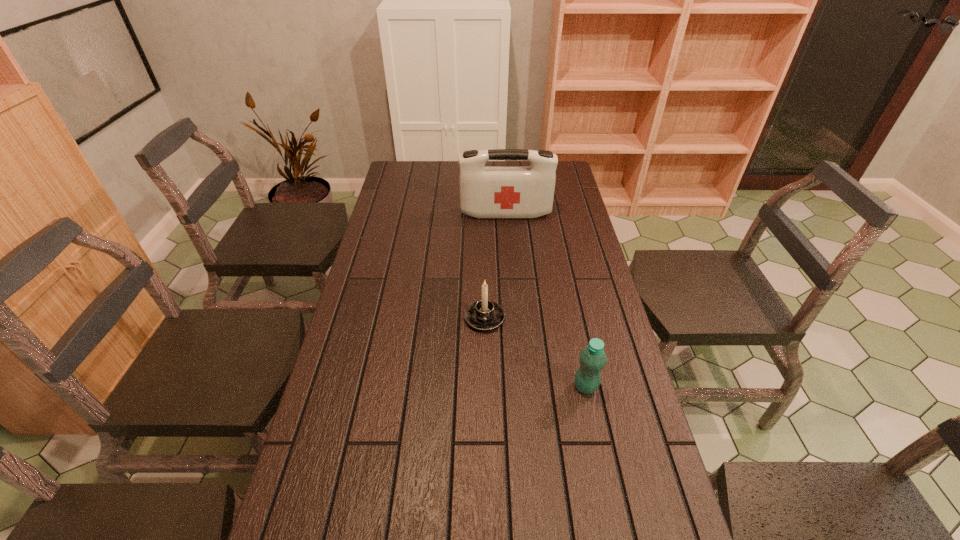
The width and height of the screenshot is (960, 540). In order to click on the tallest object in this screenshot , I will do `click(484, 191)`.

Find the location of a particular element. The width and height of the screenshot is (960, 540). the first-aid kit is located at coordinates (484, 191).

Image resolution: width=960 pixels, height=540 pixels. Identify the location of the nearest object. (592, 358).

You are a GUI agent. You are given a task and a screenshot of the screen. Output one action in this format:
    pyautogui.click(x=<x>, y=<y>)
    Task: Click on the candle holder
    
    Given the screenshot: What is the action you would take?
    pyautogui.click(x=484, y=315)

Locate an element on the screen. free location located on the front side of the farthest object is located at coordinates (508, 248).

Locate an element on the screen. This screenshot has width=960, height=540. free point located 0.250m at the front cap of the nearest object is located at coordinates (474, 386).

Identify the location of vacant region located 0.220m at the front cap of the nearest object. (486, 386).

You are a GUI agent. You are given a task and a screenshot of the screen. Output one action in this format:
    pyautogui.click(x=<x>, y=<y>)
    Task: Click on the vacant region located at the front cap of the nearest object
    This screenshot has height=540, width=960.
    Given the screenshot: What is the action you would take?
    pyautogui.click(x=541, y=386)

At what (x,y) coordinates should I click in order to perform the action: click on vacant space positioned with a handle on the side of the candle holder. Please return your answer as a coordinate pair (x, y). The image size is (960, 540). Looking at the image, I should click on (485, 353).

The height and width of the screenshot is (540, 960). What are the coordinates of `the first-aid kit present at the right edge` in the screenshot? It's located at (484, 191).